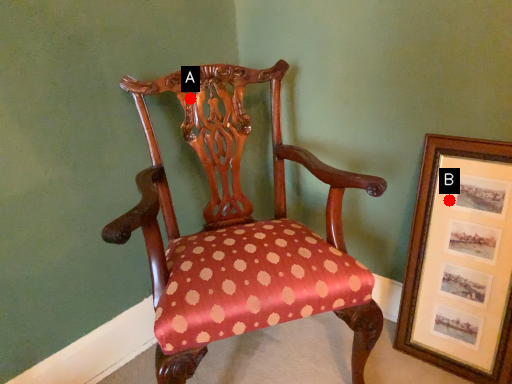
Question: Two points are circled on the image, labeled by A and B beside each circle. Which of the following is the farthest from the observer?

Choices:
 (A) A is further
 (B) B is further

Answer: (A)